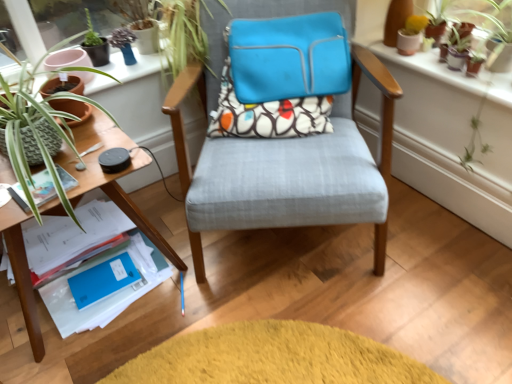
Question: Considering the positions of textured fabric chair at center, marked as the second chair in a back-to-front arrangement, and matte paper at left, which is the second paperback book from back to front, in the image, is textured fabric chair at center, marked as the second chair in a back-to-front arrangement, wider or thinner than matte paper at left, which is the second paperback book from back to front,?

Choices:
 (A) thin
 (B) wide

Answer: (B)

Question: Does point (357, 147) appear closer or farther from the camera than point (49, 175)?

Choices:
 (A) closer
 (B) farther

Answer: (B)

Question: Which object is the closest to the matte terracotta pot at left?

Choices:
 (A) textured fabric chair at center, marked as the 1th chair in a front-to-back arrangement
 (B) patterned fabric pillow at center
 (C) wooden table at left
 (D) terracotta clay pots at upper right
 (E) matte paper at left, arranged as the 1th paperback book when viewed from the top

Answer: (E)

Question: Considering the real-world distances, which object is farthest from the matte blue laptop case at center, which appears as the 2th chair when viewed from the front?

Choices:
 (A) patterned fabric pillow at center
 (B) textured fabric chair at center, marked as the second chair in a back-to-front arrangement
 (C) blue matte paper at lower left, the first paperback book from the back
 (D) terracotta clay pots at upper right
 (E) wooden table at left

Answer: (C)